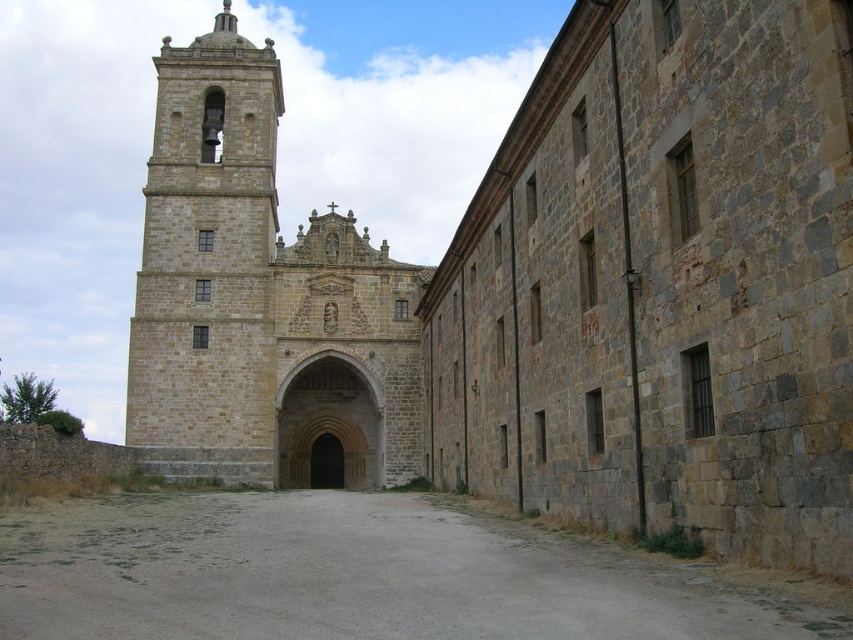
Question: Can you confirm if stone tower at center is positioned to the right of gray concrete alley at center?

Choices:
 (A) yes
 (B) no

Answer: (B)

Question: Does stone tower at center appear under gray concrete alley at center?

Choices:
 (A) yes
 (B) no

Answer: (B)

Question: Considering the relative positions of stone tower at center and gray concrete alley at center in the image provided, where is stone tower at center located with respect to gray concrete alley at center?

Choices:
 (A) above
 (B) below

Answer: (A)

Question: Which point is closer to the camera taking this photo?

Choices:
 (A) (351, 417)
 (B) (438, 592)

Answer: (B)

Question: Which of the following is the farthest from the observer?

Choices:
 (A) (732, 598)
 (B) (421, 456)

Answer: (B)

Question: Among these objects, which one is farthest from the camera?

Choices:
 (A) gray concrete alley at center
 (B) stone tower at center

Answer: (B)